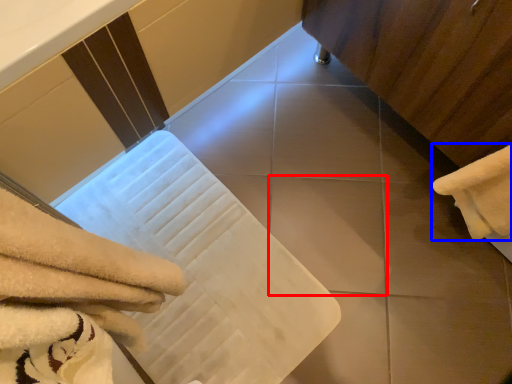
Question: Which point is closer to the camera, tile (highlighted by a red box) or towel (highlighted by a blue box)?

Choices:
 (A) tile
 (B) towel

Answer: (B)